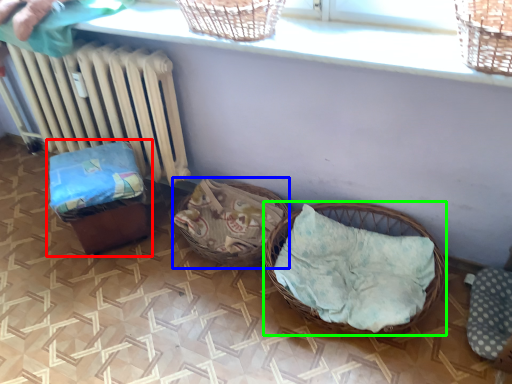
Question: Estimate the real-world distances between objects in this image. Which object is farther from baby carriage (highlighted by a red box), basket (highlighted by a blue box) or picnic basket (highlighted by a green box)?

Choices:
 (A) basket
 (B) picnic basket

Answer: (B)